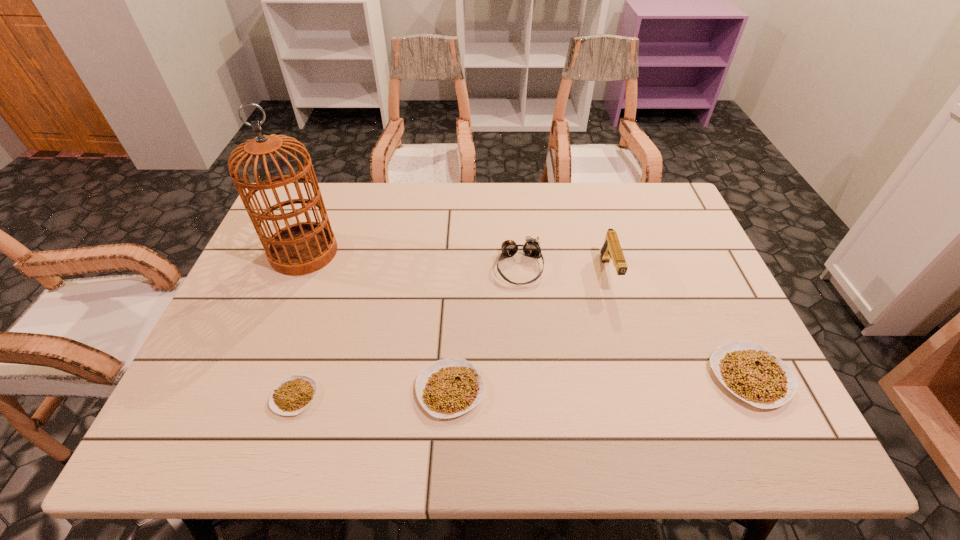
This screenshot has height=540, width=960. I want to click on free space between the rightmost legume and the leftmost legume, so click(x=522, y=387).

You are a GUI agent. You are given a task and a screenshot of the screen. Output one action in this format:
    pyautogui.click(x=<x>, y=<y>)
    Task: Click on the vacant point located between the goggles and the third object from left to right
    
    Given the screenshot: What is the action you would take?
    pyautogui.click(x=485, y=328)

Where is `vacant point located between the shortest legume and the fifth shortest object`? This screenshot has width=960, height=540. vacant point located between the shortest legume and the fifth shortest object is located at coordinates (452, 335).

Where is `free space between the second tallest object and the third tallest object`? free space between the second tallest object and the third tallest object is located at coordinates (564, 271).

In order to click on free space between the shortest legume and the tallest object in this screenshot , I will do `click(300, 325)`.

I want to click on blank region between the third object from right to left and the second legume from right to left, so click(x=485, y=328).

Select which object is the fourth closest to the goggles. Please provide its 2D coordinates. Your answer should be formatted as a tuple, i.e. [(x, y)], where the tuple contains the x and y coordinates of a point satisfying the conditions above.

[(301, 248)]

The height and width of the screenshot is (540, 960). I want to click on object that stands as the third closest to the pistol, so click(x=448, y=388).

Select which legume is the closest to the tallest object. Please provide its 2D coordinates. Your answer should be formatted as a tuple, i.e. [(x, y)], where the tuple contains the x and y coordinates of a point satisfying the conditions above.

[(293, 394)]

Select which legume appears as the second closest to the fourth shortest object. Please provide its 2D coordinates. Your answer should be formatted as a tuple, i.e. [(x, y)], where the tuple contains the x and y coordinates of a point satisfying the conditions above.

[(751, 372)]